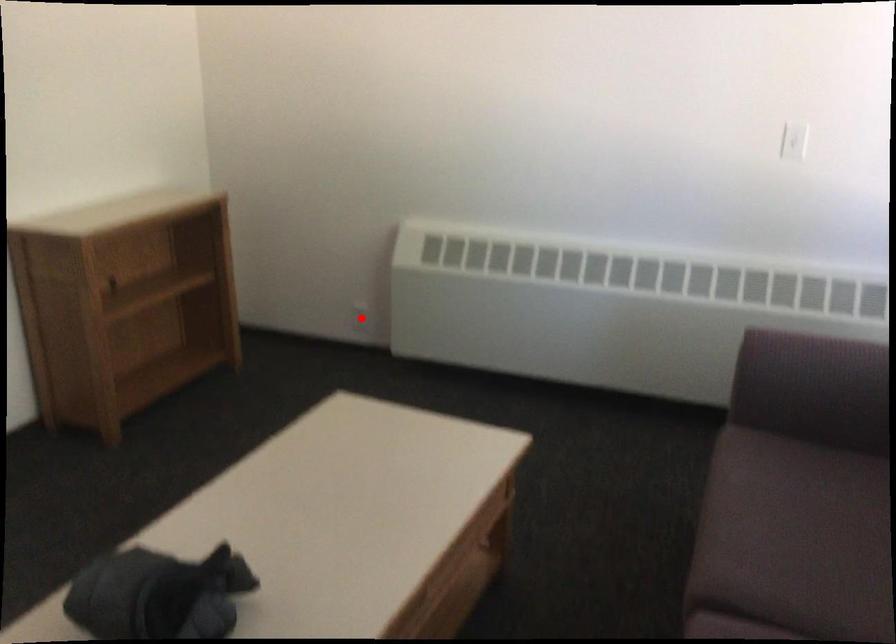
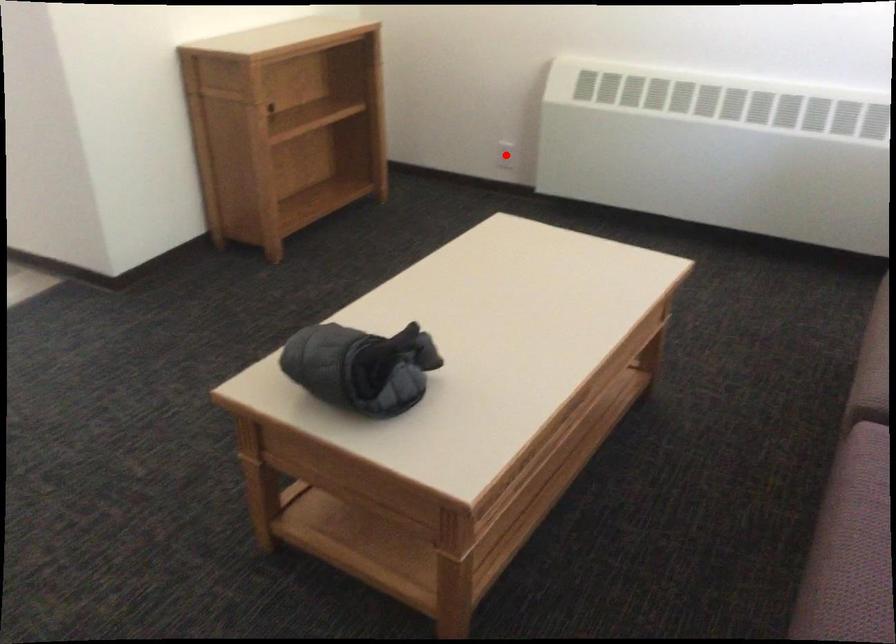
I am providing you with two images of the same scene from different viewpoints. A red point is marked on the first image and another point is marked on the second image. Are the points marked in image1 and image2 representing the same 3D position?

Yes